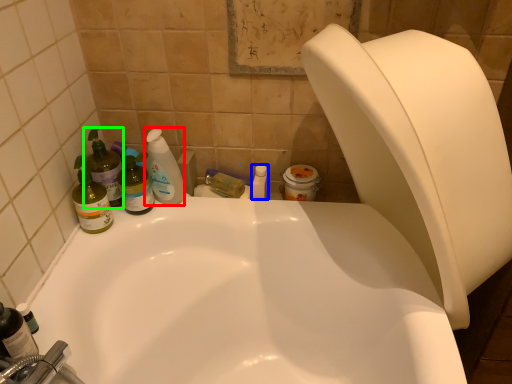
Question: Estimate the real-world distances between objects in this image. Which object is closer to cleaning product (highlighted by a red box), toiletry (highlighted by a blue box) or cleaning product (highlighted by a green box)?

Choices:
 (A) toiletry
 (B) cleaning product

Answer: (B)